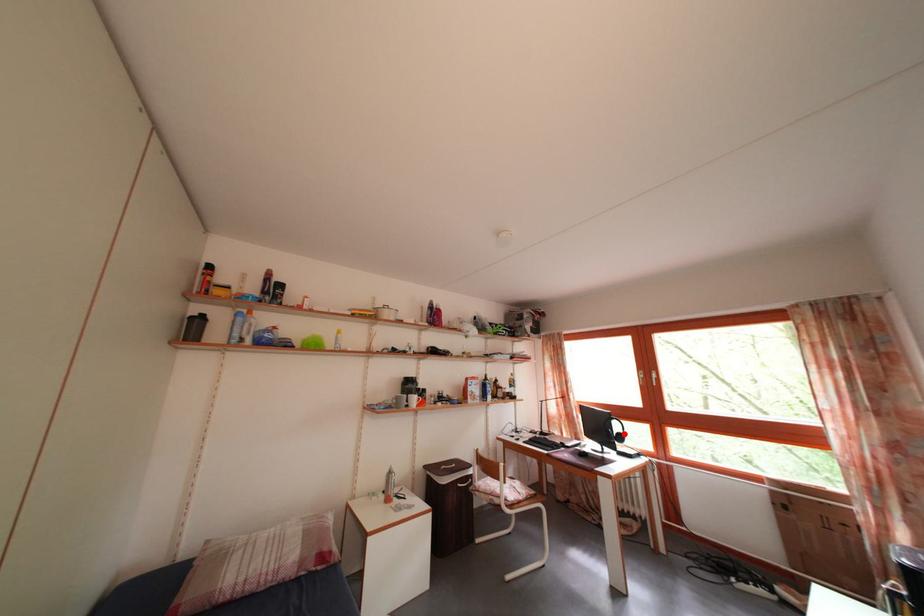
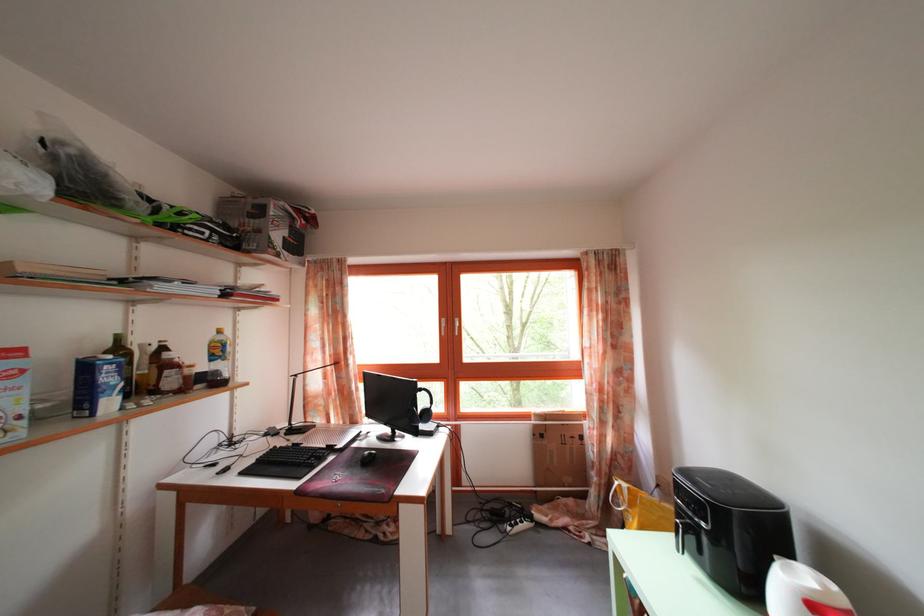
Question: I am providing you with two images of the same scene from different viewpoints. A red point is marked on the first image. At the location where the point appears in image 1, is it still visible in image 2?

Choices:
 (A) Yes
 (B) No

Answer: (B)